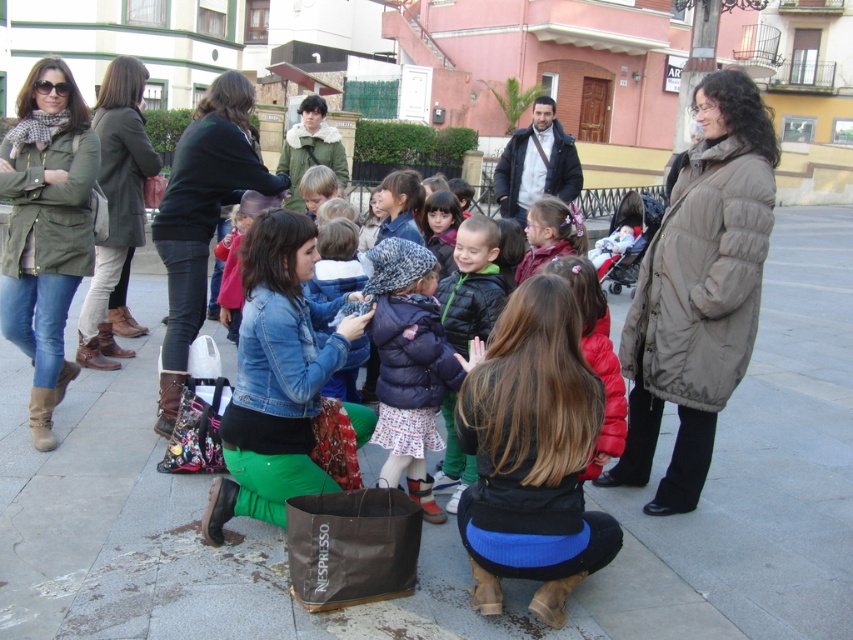
You are standing in the plaza and see both the black puffy jacket at center and the dark gray suit at center. Which one is positioned more to the left side from your perspective?

The black puffy jacket at center is positioned more to the left side from your perspective as it is to the left of the dark gray suit at center.

In the scene shown: You are a photographer at the event and want to capture a photo that includes both the green textured jacket at upper left and the dark gray suit at center. Based on their positions, which jacket should be placed on the left side of the photo?

The green textured jacket at upper left should be placed on the left side of the photo because it is positioned on the left side of the dark gray suit at center.